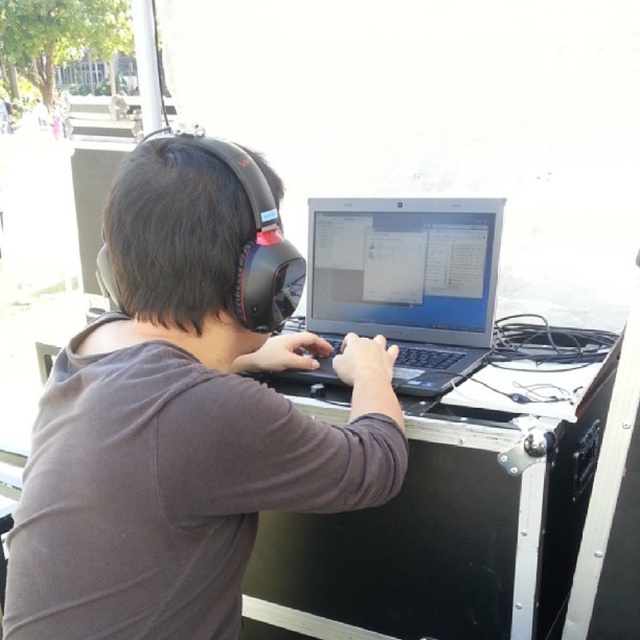
You are trying to set up a portable workstation in the park. You have a matte black headphones at center and a black metal table at center. According to the image, which object is closer to you when both are placed at center?

The matte black headphones at center is in front of the black metal table at center, so the headphones are closer to you.

You have a rectangular object that is 20 cm wide. You want to place it on either the black metal table at center or the satin black laptop at center. Which surface can definitely accommodate it without overhanging?

The black metal table at center has a larger width than the satin black laptop at center, so placing the 20 cm wide object on the black metal table at center ensures it will fit without overhanging.

In the scene shown: You are a photographer trying to capture a clear photo of the laptop screen while the person is working. Considering the position of the matte black headphones at center and the satin black laptop at center, which object might block the view of the laptop screen?

The matte black headphones at center is much taller than the satin black laptop at center, so it might block the view of the laptop screen.